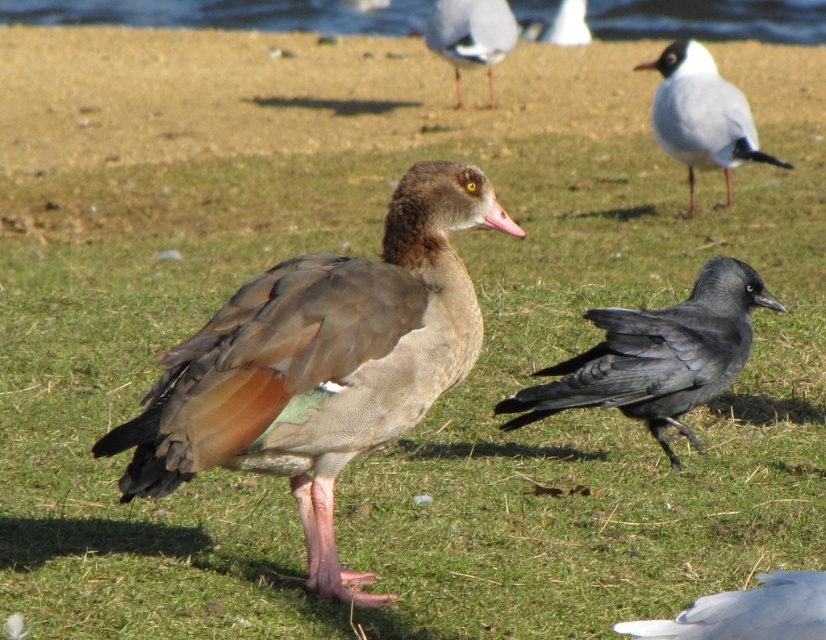
You are standing in a field and see two points in the scene. The first point is at coordinate point (681, 636) and the second is at point (509, 228). Which point is closer to you?

Point (681, 636) is closer to the viewer than point (509, 228).

You are a birdwatcher observing the scene. You notice the white feathered bird at lower right and the pink matte beak at center. Which of these two birds is taller?

The white feathered bird at lower right is much taller than the pink matte beak at center.